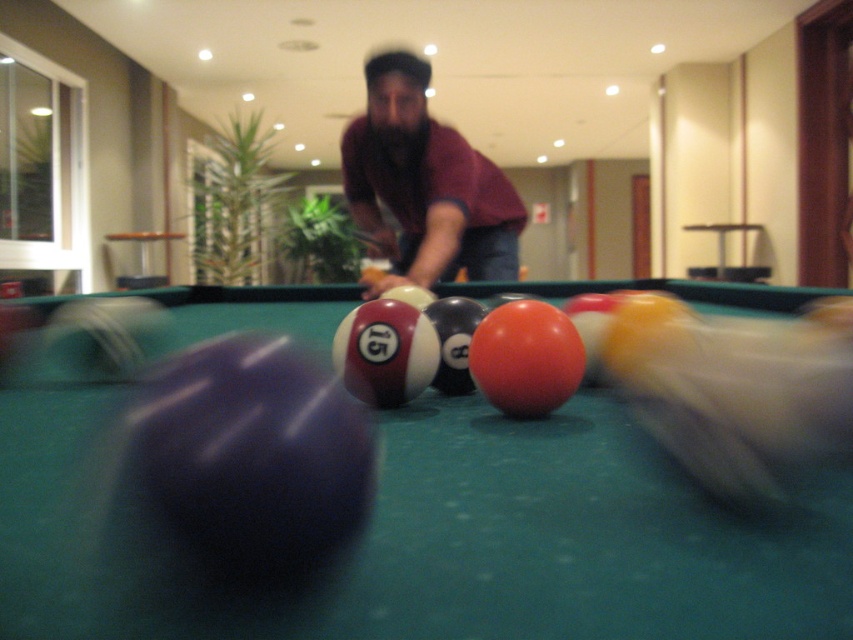
Question: Does smooth green pool table at center lie behind maroon shirt at center?

Choices:
 (A) no
 (B) yes

Answer: (A)

Question: Which of the following is the closest to the observer?

Choices:
 (A) (474, 605)
 (B) (434, 134)

Answer: (A)

Question: Does smooth green pool table at center appear under maroon shirt at center?

Choices:
 (A) no
 (B) yes

Answer: (B)

Question: Which point is farther to the camera?

Choices:
 (A) (479, 177)
 (B) (115, 636)

Answer: (A)

Question: Observing the image, what is the correct spatial positioning of smooth green pool table at center in reference to maroon shirt at center?

Choices:
 (A) right
 (B) left

Answer: (B)